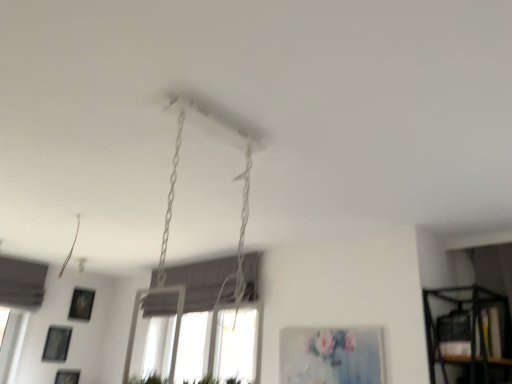
Image resolution: width=512 pixels, height=384 pixels. Identify the location of black plastic shelf at lower right. (471, 331).

The height and width of the screenshot is (384, 512). What are the coordinates of `matte black picture frame at lower left, the 1th picture frame viewed from the back` in the screenshot? It's located at (81, 304).

You are a GUI agent. You are given a task and a screenshot of the screen. Output one action in this format:
    pyautogui.click(x=<x>, y=<y>)
    Task: Click on the matte blue canvas at center, which appears as the 1th picture frame when viewed from the right
    The image size is (512, 384).
    Given the screenshot: What is the action you would take?
    pyautogui.click(x=331, y=355)

What do you see at coordinates (67, 376) in the screenshot? The width and height of the screenshot is (512, 384). I see `matte black picture frame at lower left, which is counted as the 2th picture frame, starting from the front` at bounding box center [67, 376].

Find the location of a particular element. black plastic shelf at lower right is located at coordinates (471, 331).

Where is `picture frame behind the matte black picture frame at lower left, which appears as the second picture frame when viewed from the back`? The height and width of the screenshot is (384, 512). picture frame behind the matte black picture frame at lower left, which appears as the second picture frame when viewed from the back is located at coordinates (81, 304).

From a real-world perspective, is matte black picture frame at lower left, which ranks as the first picture frame in left-to-right order, over matte black picture frame at lower left, which is the 3th picture frame from left to right?

No, from a real-world perspective, matte black picture frame at lower left, which ranks as the first picture frame in left-to-right order, is not above matte black picture frame at lower left, which is the 3th picture frame from left to right.

Who is smaller, matte black picture frame at lower left, the third picture frame viewed from the top, or matte black picture frame at lower left, which is the 3th picture frame from left to right?

matte black picture frame at lower left, the third picture frame viewed from the top, is smaller.

Considering the relative positions of matte black picture frame at lower left, the third picture frame viewed from the top, and matte black picture frame at lower left, positioned as the 2th picture frame in top-to-bottom order, in the image provided, is matte black picture frame at lower left, the third picture frame viewed from the top, to the right of matte black picture frame at lower left, positioned as the 2th picture frame in top-to-bottom order, from the viewer's perspective?

In fact, matte black picture frame at lower left, the third picture frame viewed from the top, is to the left of matte black picture frame at lower left, positioned as the 2th picture frame in top-to-bottom order.

Is matte blue canvas at center, placed as the fourth picture frame when sorted from left to right, inside the boundaries of matte black picture frame at lower left, arranged as the 4th picture frame when viewed from the right, or outside?

matte blue canvas at center, placed as the fourth picture frame when sorted from left to right, is not enclosed by matte black picture frame at lower left, arranged as the 4th picture frame when viewed from the right.

There is a matte black picture frame at lower left, the third picture frame viewed from the top. Identify the location of the 2nd picture frame above it (from the image's perspective). (331, 355).

Considering the sizes of objects matte blue canvas at center, which is the first picture frame from front to back, and matte black picture frame at lower left, which appears as the second picture frame when viewed from the back, in the image provided, who is taller, matte blue canvas at center, which is the first picture frame from front to back, or matte black picture frame at lower left, which appears as the second picture frame when viewed from the back,?

matte blue canvas at center, which is the first picture frame from front to back, is taller.

How distant is black plastic shelf at lower right from matte black picture frame at lower left, which ranks as the second picture frame in bottom-to-top order?

black plastic shelf at lower right and matte black picture frame at lower left, which ranks as the second picture frame in bottom-to-top order, are 3.83 meters apart.

From the image's perspective, would you say black plastic shelf at lower right is positioned over matte black picture frame at lower left, which is counted as the 3th picture frame, starting from the front?

Correct, black plastic shelf at lower right appears higher than matte black picture frame at lower left, which is counted as the 3th picture frame, starting from the front, in the image.

Which is in front, black plastic shelf at lower right or matte black picture frame at lower left, which is counted as the 3th picture frame, starting from the front?

Positioned in front is black plastic shelf at lower right.

Are black plastic shelf at lower right and matte black picture frame at lower left, which ranks as the first picture frame in left-to-right order, far apart?

Yes.

Is point (77, 295) more distant than point (73, 378)?

Yes.

Is matte black picture frame at lower left, acting as the third picture frame starting from the bottom, positioned far away from matte black picture frame at lower left, which is the 2th picture frame from left to right?

No, there isn't a large distance between matte black picture frame at lower left, acting as the third picture frame starting from the bottom, and matte black picture frame at lower left, which is the 2th picture frame from left to right.

Is matte black picture frame at lower left, the 1th picture frame viewed from the back, positioned in front of matte black picture frame at lower left, the first picture frame when ordered from bottom to top?

That is False.

Is matte black picture frame at lower left, positioned as the 2th picture frame in top-to-bottom order, outside of matte black picture frame at lower left, the first picture frame when ordered from bottom to top?

That's correct, matte black picture frame at lower left, positioned as the 2th picture frame in top-to-bottom order, is outside of matte black picture frame at lower left, the first picture frame when ordered from bottom to top.

Is black plastic shelf at lower right further to the viewer compared to matte blue canvas at center, acting as the fourth picture frame starting from the bottom?

No, black plastic shelf at lower right is in front of matte blue canvas at center, acting as the fourth picture frame starting from the bottom.

From a real-world perspective, is black plastic shelf at lower right above or below matte blue canvas at center, which is the first picture frame from front to back?

black plastic shelf at lower right is above matte blue canvas at center, which is the first picture frame from front to back.

Is black plastic shelf at lower right wider or thinner than matte blue canvas at center, which is the fourth picture frame from back to front?

black plastic shelf at lower right is wider than matte blue canvas at center, which is the fourth picture frame from back to front.

Which object is positioned more to the left, black plastic shelf at lower right or matte blue canvas at center, arranged as the first picture frame when viewed from the top?

matte blue canvas at center, arranged as the first picture frame when viewed from the top, is more to the left.

Between matte black picture frame at lower left, the 1th picture frame viewed from the back, and black plastic shelf at lower right, which one has larger size?

black plastic shelf at lower right.

In terms of height, does matte black picture frame at lower left, marked as the fourth picture frame in a front-to-back arrangement, look taller or shorter compared to black plastic shelf at lower right?

In the image, matte black picture frame at lower left, marked as the fourth picture frame in a front-to-back arrangement, appears to be taller than black plastic shelf at lower right.

Can you confirm if matte black picture frame at lower left, which is the 3th picture frame from left to right, is wider than black plastic shelf at lower right?

In fact, matte black picture frame at lower left, which is the 3th picture frame from left to right, might be narrower than black plastic shelf at lower right.

Is matte black picture frame at lower left, marked as the fourth picture frame in a front-to-back arrangement, positioned with its back to black plastic shelf at lower right?

No.

Can you confirm if matte blue canvas at center, placed as the fourth picture frame when sorted from left to right, is positioned to the right of black plastic shelf at lower right?

Incorrect, matte blue canvas at center, placed as the fourth picture frame when sorted from left to right, is not on the right side of black plastic shelf at lower right.

Measure the distance between matte blue canvas at center, which is the fourth picture frame from back to front, and black plastic shelf at lower right.

matte blue canvas at center, which is the fourth picture frame from back to front, and black plastic shelf at lower right are 22.37 inches apart.

From the image's perspective, is matte blue canvas at center, which appears as the 1th picture frame when viewed from the right, located above or below black plastic shelf at lower right?

Based on their image positions, matte blue canvas at center, which appears as the 1th picture frame when viewed from the right, is located beneath black plastic shelf at lower right.

Are matte blue canvas at center, which is the fourth picture frame from back to front, and black plastic shelf at lower right making contact?

No, matte blue canvas at center, which is the fourth picture frame from back to front, is not touching black plastic shelf at lower right.

At what (x,y) coordinates should I click in order to perform the action: click on picture frame behind the matte black picture frame at lower left, which appears as the second picture frame when viewed from the back. Please return your answer as a coordinate pair (x, y). This screenshot has height=384, width=512. Looking at the image, I should click on (81, 304).

I want to click on the 2nd picture frame below when counting from the matte blue canvas at center, placed as the fourth picture frame when sorted from left to right (from the image's perspective), so click(57, 344).

From the picture: Looking at the image, which one is located closer to matte black picture frame at lower left, the first picture frame when ordered from bottom to top, black plastic shelf at lower right or matte black picture frame at lower left, which ranks as the first picture frame in left-to-right order?

matte black picture frame at lower left, which ranks as the first picture frame in left-to-right order, is positioned closer to the anchor matte black picture frame at lower left, the first picture frame when ordered from bottom to top.

Which object lies further to the anchor point black plastic shelf at lower right, matte blue canvas at center, acting as the fourth picture frame starting from the bottom, or matte black picture frame at lower left, which is the 2th picture frame from left to right?

matte black picture frame at lower left, which is the 2th picture frame from left to right, is positioned further to the anchor black plastic shelf at lower right.

From the image, which object appears to be nearer to matte blue canvas at center, which appears as the 1th picture frame when viewed from the right, matte black picture frame at lower left, which appears as the second picture frame when viewed from the back, or matte black picture frame at lower left, the 1th picture frame viewed from the back?

matte black picture frame at lower left, the 1th picture frame viewed from the back, is closer to matte blue canvas at center, which appears as the 1th picture frame when viewed from the right.

Estimate the real-world distances between objects in this image. Which object is closer to matte blue canvas at center, placed as the fourth picture frame when sorted from left to right, matte black picture frame at lower left, the first picture frame when ordered from bottom to top, or black plastic shelf at lower right?

black plastic shelf at lower right.

Estimate the real-world distances between objects in this image. Which object is closer to matte black picture frame at lower left, the third picture frame viewed from the top, matte black picture frame at lower left, marked as the fourth picture frame in a front-to-back arrangement, or black plastic shelf at lower right?

Among the two, matte black picture frame at lower left, marked as the fourth picture frame in a front-to-back arrangement, is located nearer to matte black picture frame at lower left, the third picture frame viewed from the top.

From the image, which object appears to be farther from matte black picture frame at lower left, the third picture frame viewed from the top, black plastic shelf at lower right or matte blue canvas at center, which is the fourth picture frame from back to front?

black plastic shelf at lower right.

Based on their spatial positions, is matte blue canvas at center, which appears as the 1th picture frame when viewed from the right, or black plastic shelf at lower right further from matte black picture frame at lower left, which is counted as the 3th picture frame, starting from the front?

Based on the image, black plastic shelf at lower right appears to be further to matte black picture frame at lower left, which is counted as the 3th picture frame, starting from the front.

Considering their positions, is matte blue canvas at center, which is the fourth picture frame from back to front, positioned further to black plastic shelf at lower right than matte black picture frame at lower left, arranged as the 4th picture frame when viewed from the right?

Based on the image, matte black picture frame at lower left, arranged as the 4th picture frame when viewed from the right, appears to be further to black plastic shelf at lower right.

The width and height of the screenshot is (512, 384). Identify the location of picture frame situated between matte black picture frame at lower left, which is counted as the 2th picture frame, starting from the front, and matte blue canvas at center, placed as the fourth picture frame when sorted from left to right, from left to right. (x=81, y=304).

The image size is (512, 384). In order to click on picture frame between matte black picture frame at lower left, the 1th picture frame viewed from the back, and black plastic shelf at lower right, in the horizontal direction in this screenshot , I will do `click(331, 355)`.

The width and height of the screenshot is (512, 384). I want to click on picture frame between matte black picture frame at lower left, marked as the fourth picture frame in a front-to-back arrangement, and matte black picture frame at lower left, which is counted as the 2th picture frame, starting from the front, in the vertical direction, so click(57, 344).